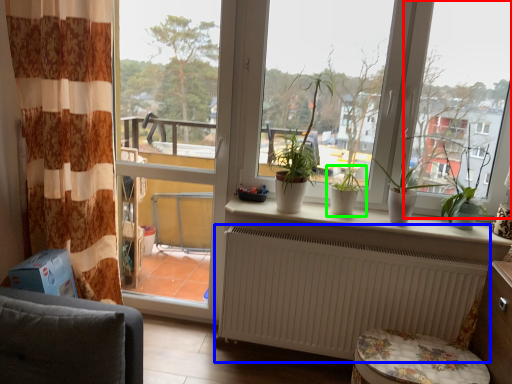
Question: Considering the real-world distances, which object is closest to window screen (highlighted by a red box)? radiator (highlighted by a blue box) or houseplant (highlighted by a green box).

Choices:
 (A) radiator
 (B) houseplant

Answer: (B)